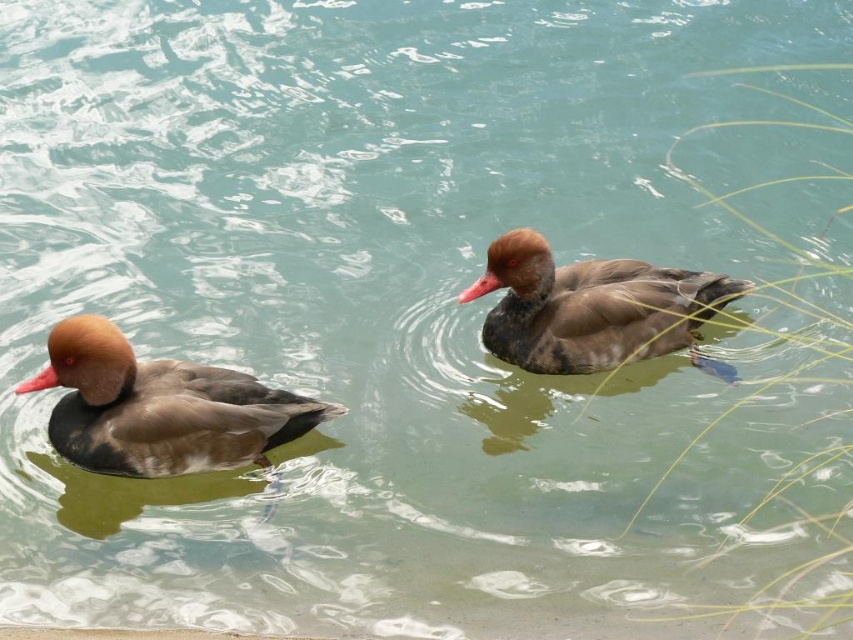
Question: Is brown matte duck at left behind brown matte duck at center?

Choices:
 (A) yes
 (B) no

Answer: (B)

Question: Is brown matte duck at left positioned behind brown matte duck at center?

Choices:
 (A) no
 (B) yes

Answer: (A)

Question: Does brown matte duck at left come behind brown matte duck at center?

Choices:
 (A) yes
 (B) no

Answer: (B)

Question: Which object is closer to the camera taking this photo?

Choices:
 (A) brown matte duck at center
 (B) brown matte duck at left

Answer: (B)